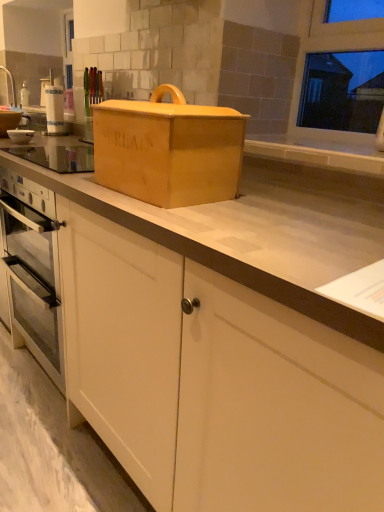
Question: Can you confirm if matte wooden bread box at center is wider than white glossy bowl at left?

Choices:
 (A) yes
 (B) no

Answer: (A)

Question: From a real-world perspective, is matte wooden bread box at center positioned over white glossy bowl at left based on gravity?

Choices:
 (A) no
 (B) yes

Answer: (B)

Question: Does matte wooden bread box at center touch white glossy bowl at left?

Choices:
 (A) yes
 (B) no

Answer: (B)

Question: From a real-world perspective, is matte wooden bread box at center below white glossy bowl at left?

Choices:
 (A) no
 (B) yes

Answer: (A)

Question: Can you confirm if matte wooden bread box at center is shorter than white glossy bowl at left?

Choices:
 (A) yes
 (B) no

Answer: (B)

Question: In terms of width, does white matte cabinet at lower center look wider or thinner when compared to white glossy bowl at left?

Choices:
 (A) wide
 (B) thin

Answer: (A)

Question: In the image, is white matte cabinet at lower center positioned in front of or behind white glossy bowl at left?

Choices:
 (A) front
 (B) behind

Answer: (A)

Question: From their relative heights in the image, would you say white matte cabinet at lower center is taller or shorter than white glossy bowl at left?

Choices:
 (A) short
 (B) tall

Answer: (A)

Question: In the image, is white matte cabinet at lower center on the left side or the right side of white glossy bowl at left?

Choices:
 (A) left
 (B) right

Answer: (A)

Question: From a real-world perspective, is white glossy bowl at left above or below white matte cabinet at lower center?

Choices:
 (A) above
 (B) below

Answer: (A)

Question: Choose the correct answer: Is white glossy bowl at left inside white matte cabinet at lower center or outside it?

Choices:
 (A) outside
 (B) inside

Answer: (A)

Question: Does point (8, 131) appear closer or farther from the camera than point (311, 332)?

Choices:
 (A) closer
 (B) farther

Answer: (B)

Question: In terms of width, does white glossy bowl at left look wider or thinner when compared to white matte cabinet at lower center?

Choices:
 (A) thin
 (B) wide

Answer: (A)

Question: Looking at the image, does white glossy sink at upper left seem bigger or smaller compared to white glossy bowl at left?

Choices:
 (A) small
 (B) big

Answer: (B)

Question: From the image's perspective, relative to white glossy bowl at left, is white glossy sink at upper left above or below?

Choices:
 (A) above
 (B) below

Answer: (A)